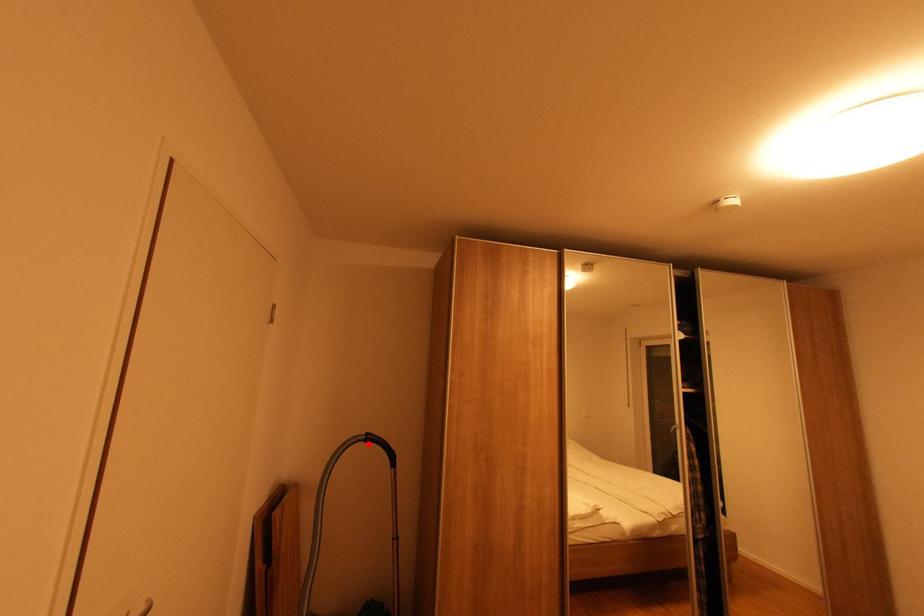
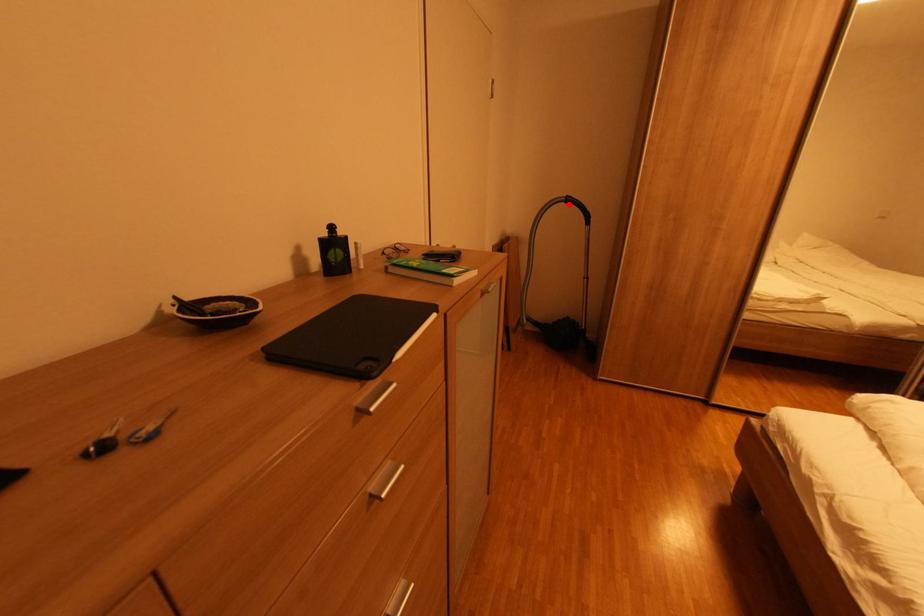
I am providing you with two images of the same scene from different viewpoints. A red point is marked on the first image and another point is marked on the second image. Do the highlighted points in image1 and image2 indicate the same real-world spot?

Yes